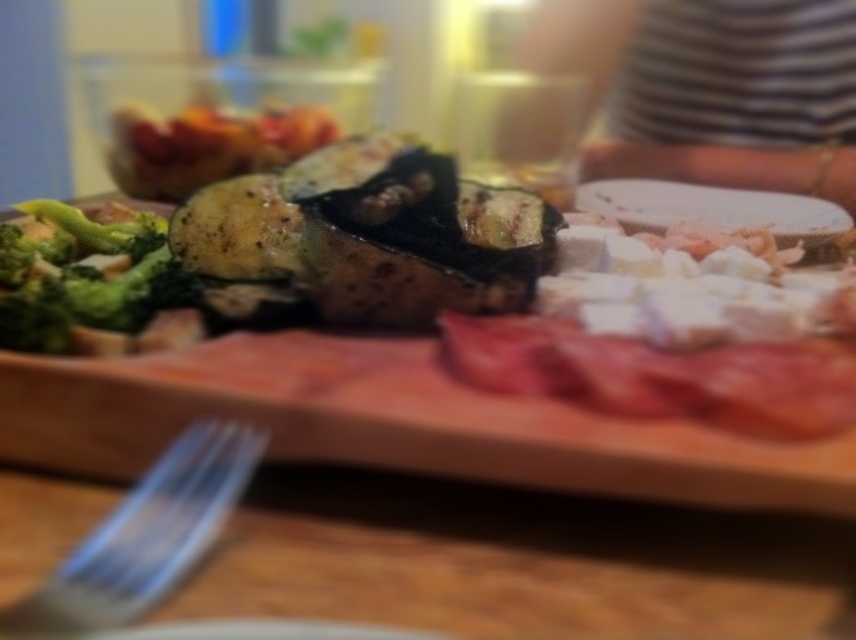
Is grilled eggplant at center positioned behind green matte broccoli at left?

No, grilled eggplant at center is in front of green matte broccoli at left.

Is grilled eggplant at center thinner than green matte broccoli at left?

No, grilled eggplant at center is not thinner than green matte broccoli at left.

Which is behind, point (619, 257) or point (91, 314)?

Positioned behind is point (619, 257).

I want to click on grilled eggplant at center, so click(x=394, y=237).

Does point (804, 404) come in front of point (22, 614)?

No, it is behind (22, 614).

The image size is (856, 640). Find the location of `grilled eggplant at center`. grilled eggplant at center is located at coordinates (394, 237).

You are a GUI agent. You are given a task and a screenshot of the screen. Output one action in this format:
    pyautogui.click(x=<x>, y=<y>)
    Task: Click on the grilled eggplant at center
    
    Given the screenshot: What is the action you would take?
    pyautogui.click(x=394, y=237)

Between silver metallic fork at lower left and green matte broccoli at left, which one has more height?

With more height is green matte broccoli at left.

How far apart are silver metallic fork at lower left and green matte broccoli at left?

A distance of 6.84 inches exists between silver metallic fork at lower left and green matte broccoli at left.

Locate an element on the screen. Image resolution: width=856 pixels, height=640 pixels. silver metallic fork at lower left is located at coordinates (147, 532).

Find the location of a particular element. The width and height of the screenshot is (856, 640). silver metallic fork at lower left is located at coordinates click(x=147, y=532).